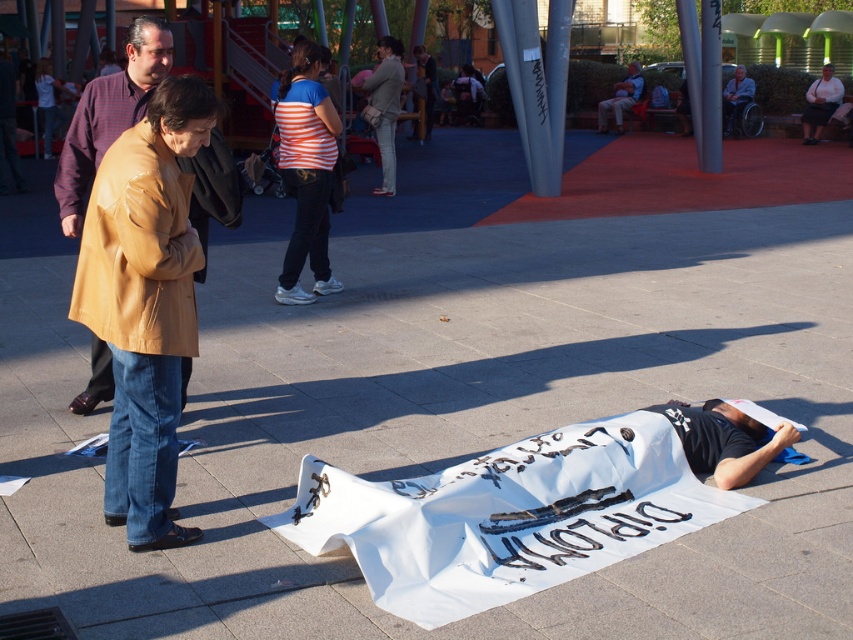
You are a photographer trying to capture both the striped fabric pants at center and the denim jacket at upper center in a single frame. Based on their sizes, which object should you focus on to ensure both are clearly visible in the photo?

The striped fabric pants at center has a smaller size compared to denim jacket at upper center. To ensure both are clearly visible, focus on the denim jacket at upper center since it is larger and will be easier to capture in the frame while still including the smaller striped fabric pants at center.

You are standing at point [277,294] and want to walk to the red carpeted area in the background. To avoid stepping on the person lying on the ground, which direction should you move relative to point [105,353]?

To avoid stepping on the person lying on the ground, you should move behind point [105,353] since it is in front of point [277,294], meaning the safe path is behind the first point towards the red carpeted area.

You are standing in the plaza and see a point marked at coordinates (142, 76). If you walk straight ahead, will you reach that point before walking 20 feet?

The point at coordinates (142, 76) is 17.11 feet away from the viewer, so yes, walking straight ahead you will reach it before walking 20 feet.